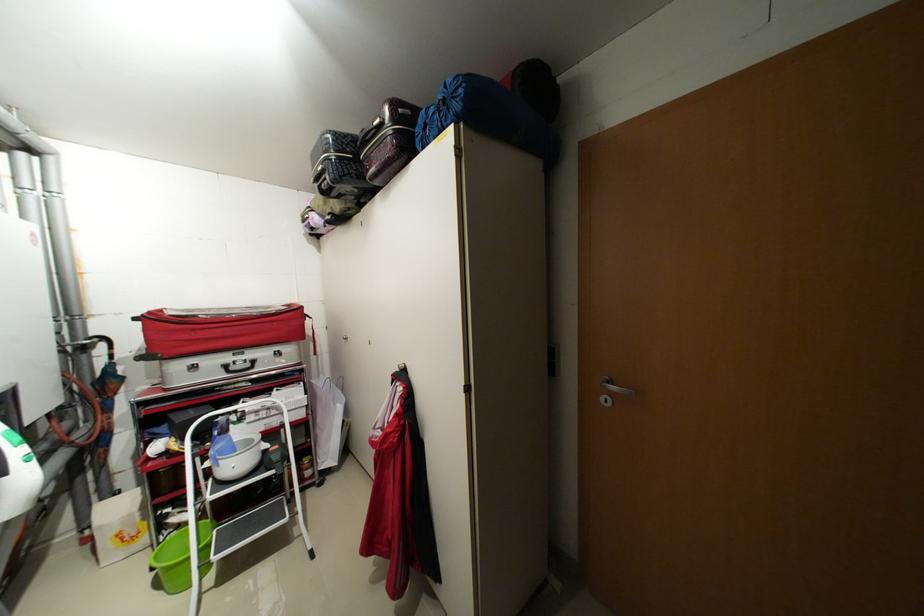
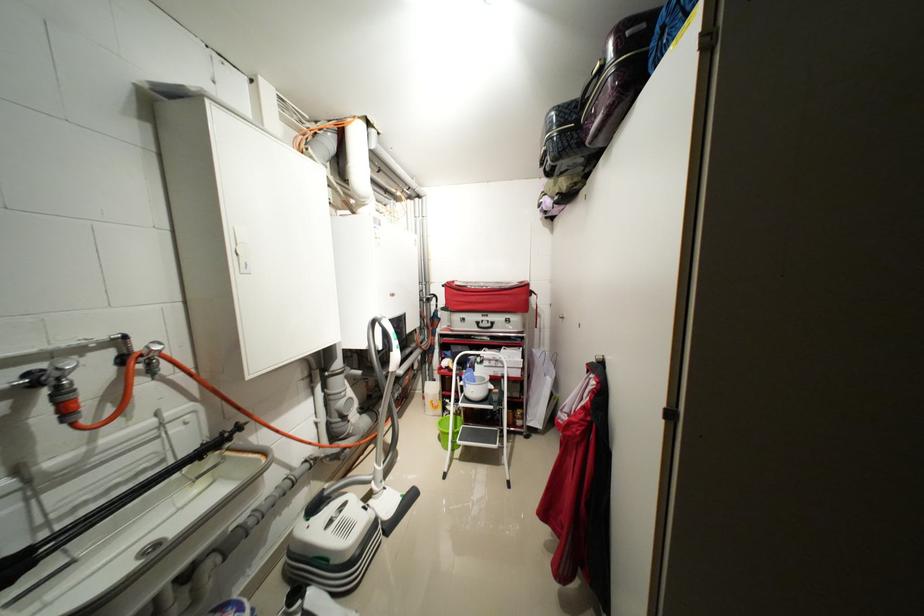
The point at [254,365] is marked in the first image. Where is the corresponding point in the second image?

(496, 326)